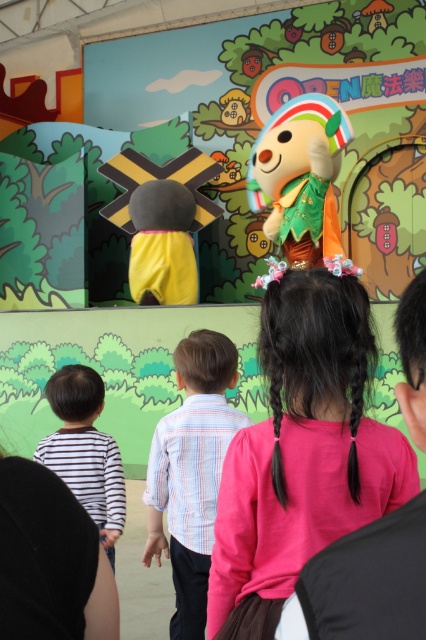
Which is in front, point (265, 129) or point (103, 536)?

Positioned in front is point (103, 536).

Is soft plush toy at center bigger than striped cotton shirt at left?

Indeed, soft plush toy at center has a larger size compared to striped cotton shirt at left.

Does point (334, 104) lie in front of point (123, 486)?

That is False.

You are a GUI agent. You are given a task and a screenshot of the screen. Output one action in this format:
    pyautogui.click(x=<x>, y=<y>)
    Task: Click on the soft plush toy at center
    
    Given the screenshot: What is the action you would take?
    pyautogui.click(x=301, y=177)

Does point (195, 608) lie behind point (92, 476)?

That is False.

Can you confirm if striped cotton shirt at center is positioned below striped cotton shirt at left?

Indeed, striped cotton shirt at center is positioned under striped cotton shirt at left.

Which is behind, point (213, 348) or point (104, 525)?

The point (104, 525) is behind.

Where is `striped cotton shirt at center`? striped cotton shirt at center is located at coordinates pos(192,472).

Between point (226, 342) and point (278, 195), which one is positioned in front?

Point (226, 342)

Between striped cotton shirt at center and soft plush toy at center, which one has more height?

soft plush toy at center

Image resolution: width=426 pixels, height=640 pixels. In order to click on striped cotton shirt at center in this screenshot , I will do `click(192, 472)`.